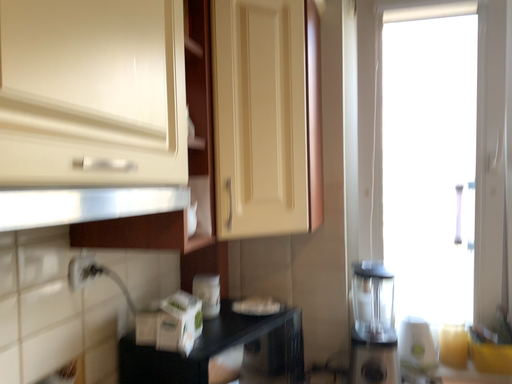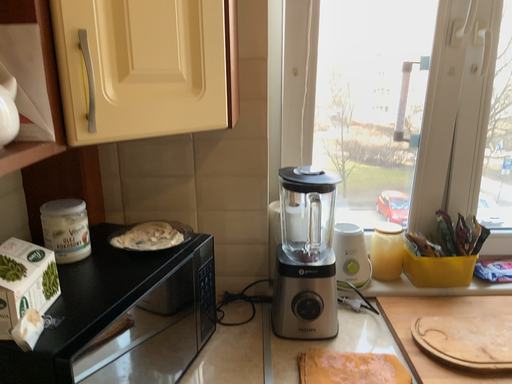
Question: Which way did the camera rotate in the video?

Choices:
 (A) rotated upward
 (B) rotated downward

Answer: (B)